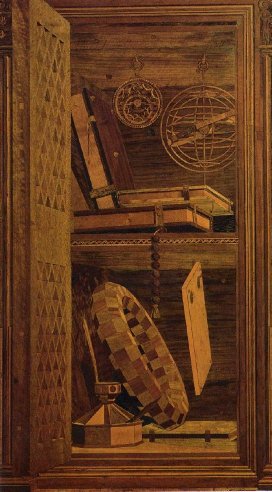
The image size is (272, 492). What are the coordinates of `door` in the screenshot? It's located at (48, 391).